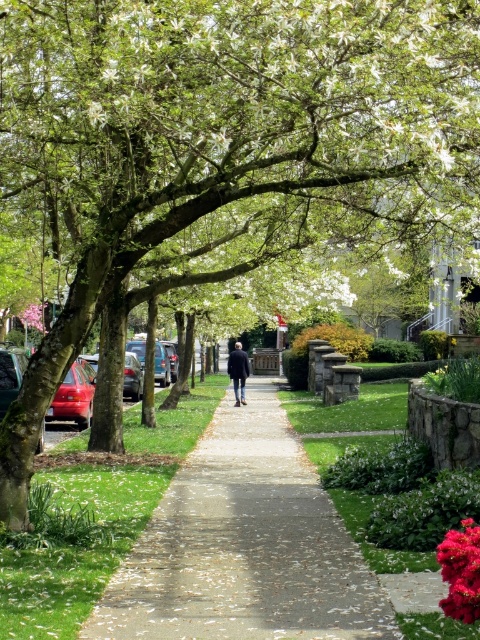
Question: Can you confirm if shiny red car at left is positioned to the right of dark blue jacket at center?

Choices:
 (A) yes
 (B) no

Answer: (B)

Question: Which of the following is the closest to the observer?

Choices:
 (A) vivid crimson petals at center right
 (B) dark blue jacket at center
 (C) concrete sidewalk at center

Answer: (A)

Question: Does concrete sidewalk at center lie behind shiny red car at left?

Choices:
 (A) no
 (B) yes

Answer: (A)

Question: Which point appears closest to the camera in this image?

Choices:
 (A) (176, 608)
 (B) (447, 548)
 (C) (84, 384)
 (D) (228, 368)

Answer: (B)

Question: Which is farther from the vivid crimson petals at center right?

Choices:
 (A) concrete sidewalk at center
 (B) shiny red car at left

Answer: (B)

Question: Is concrete sidewalk at center smaller than dark blue jacket at center?

Choices:
 (A) yes
 (B) no

Answer: (A)